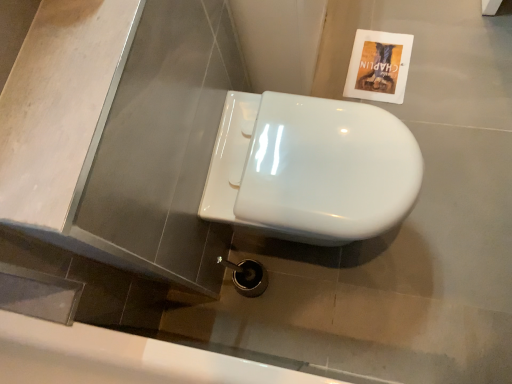
This screenshot has height=384, width=512. Find the location of `free space above matte paper flyer at upper right (from a real-world perspective)`. free space above matte paper flyer at upper right (from a real-world perspective) is located at coordinates coord(377,60).